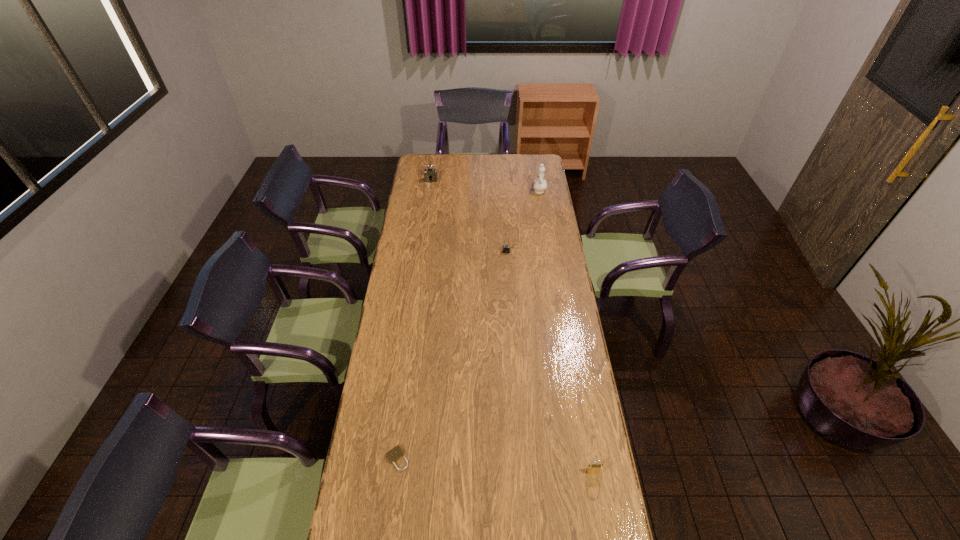
Where is `blank region between the third nearest padlock and the shortest object`? Image resolution: width=960 pixels, height=540 pixels. blank region between the third nearest padlock and the shortest object is located at coordinates (451, 355).

The image size is (960, 540). Find the location of `free space between the shortest padlock and the tallest object`. free space between the shortest padlock and the tallest object is located at coordinates (468, 324).

The height and width of the screenshot is (540, 960). I want to click on vacant area that lies between the tallest padlock and the rightmost padlock, so click(513, 326).

You are a GUI agent. You are given a task and a screenshot of the screen. Output one action in this format:
    pyautogui.click(x=<x>, y=<y>)
    Task: Click on the vacant area that lies between the tallest object and the farthest object
    The height and width of the screenshot is (540, 960).
    Given the screenshot: What is the action you would take?
    pyautogui.click(x=485, y=185)

The width and height of the screenshot is (960, 540). In order to click on vacant space that is in between the farthest object and the chinaware in this screenshot , I will do `click(485, 185)`.

At what (x,y) coordinates should I click in order to perform the action: click on vacant area between the fourth nearest object and the shortest object. Please return your answer as a coordinate pair (x, y). Looking at the image, I should click on (468, 324).

Where is `empty location between the third nearest padlock and the chinaware`? This screenshot has height=540, width=960. empty location between the third nearest padlock and the chinaware is located at coordinates (522, 221).

Where is `vacant area between the farthest object and the third farthest object`? This screenshot has width=960, height=540. vacant area between the farthest object and the third farthest object is located at coordinates (468, 216).

Locate an element on the screen. free space between the rightmost padlock and the shortest padlock is located at coordinates (495, 465).

Find the location of a particular element. free space between the rightmost padlock and the third object from left to right is located at coordinates (550, 361).